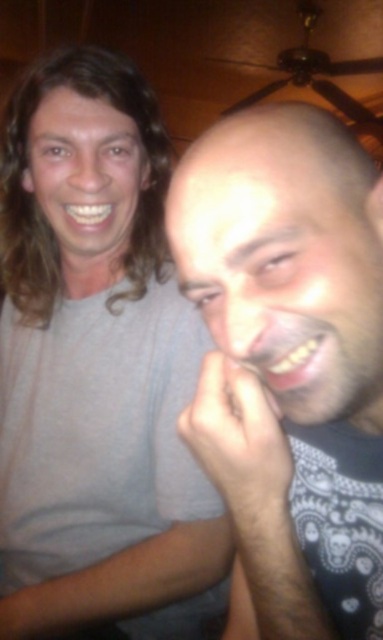
Question: Which of the following is the closest to the observer?

Choices:
 (A) gray matte shirt at upper left
 (B) dark gray shirt at right

Answer: (B)

Question: Is gray matte shirt at upper left to the left of dark gray shirt at right from the viewer's perspective?

Choices:
 (A) no
 (B) yes

Answer: (B)

Question: Which of the following is the closest to the observer?

Choices:
 (A) dark gray shirt at right
 (B) gray matte shirt at upper left

Answer: (A)

Question: Can you confirm if gray matte shirt at upper left is thinner than dark gray shirt at right?

Choices:
 (A) yes
 (B) no

Answer: (B)

Question: Can you confirm if gray matte shirt at upper left is positioned to the right of dark gray shirt at right?

Choices:
 (A) yes
 (B) no

Answer: (B)